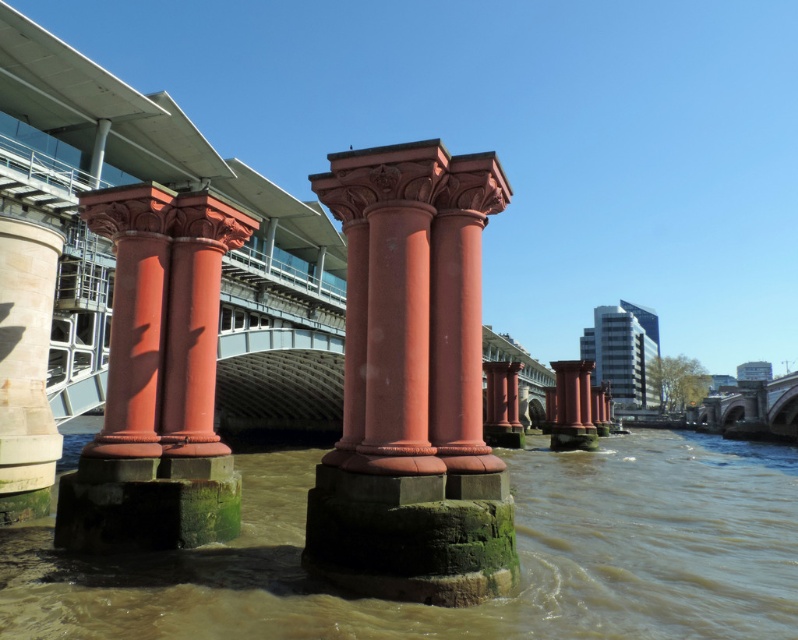
Question: Which point is closer to the camera?

Choices:
 (A) white stone column at left
 (B) green mossy concrete at lower center
 (C) matte red column at left

Answer: (B)

Question: Can you confirm if green mossy concrete at lower center is positioned to the right of matte red column at left?

Choices:
 (A) yes
 (B) no

Answer: (A)

Question: Can you confirm if matte red column at center is positioned above matte red column at left?

Choices:
 (A) no
 (B) yes

Answer: (A)

Question: Is green mossy concrete at lower center further to camera compared to matte red column at left?

Choices:
 (A) no
 (B) yes

Answer: (A)

Question: Which point is farther to the camera?

Choices:
 (A) (42, 285)
 (B) (465, 436)
 (C) (109, 452)

Answer: (A)

Question: Which point is farther to the camera?

Choices:
 (A) matte red column at center
 (B) matte red column at left

Answer: (B)